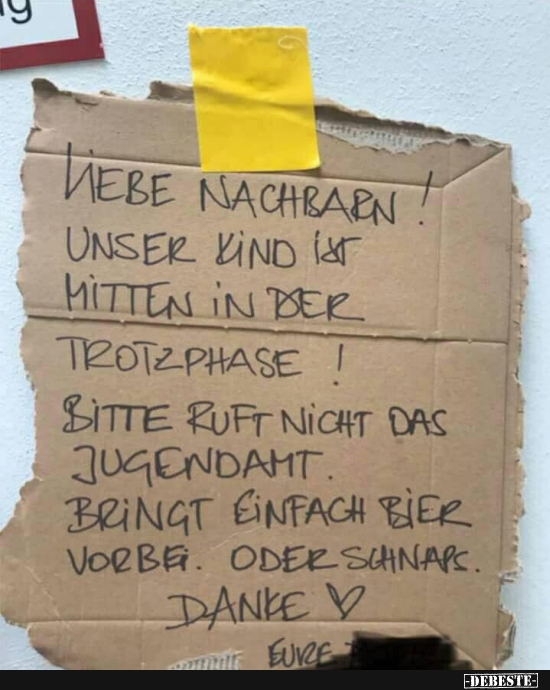
What are the coordinates of `tape sticks to the stucco wall here` in the screenshot? It's located at (309, 56), (248, 63), (210, 43), (280, 83), (216, 72).